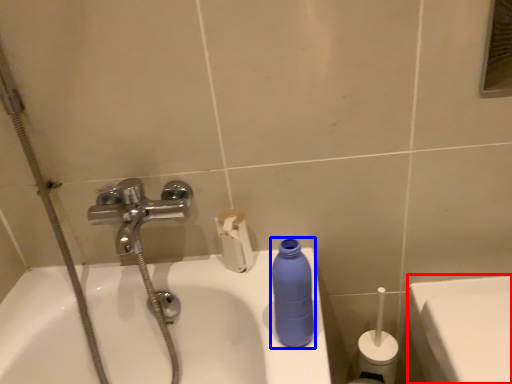
Question: Among these objects, which one is farthest to the camera, porcelain (highlighted by a red box) or cleaning product (highlighted by a blue box)?

Choices:
 (A) porcelain
 (B) cleaning product

Answer: (A)